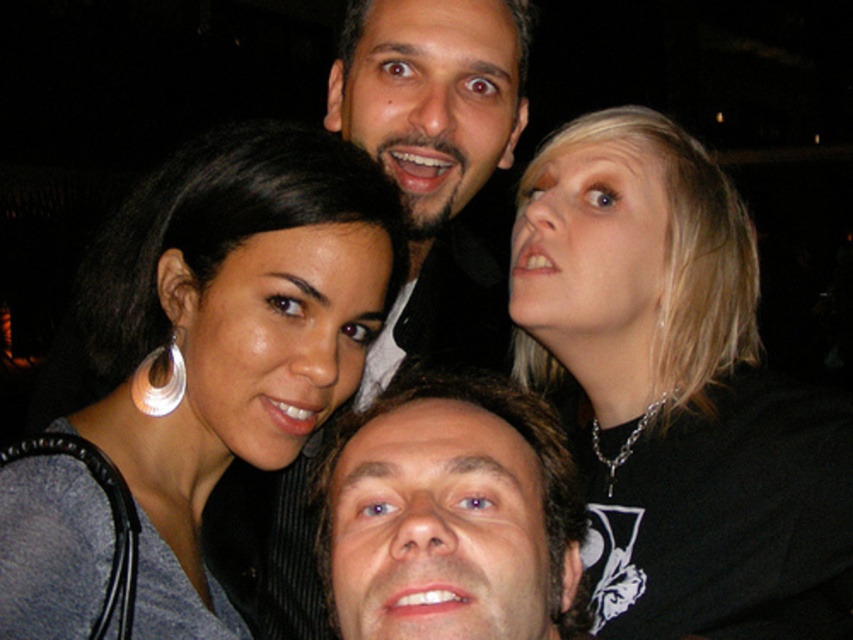
Question: Which is nearer to the bearded man at center?

Choices:
 (A) smooth black shirt at center
 (B) white plastic hoop at upper left
 (C) shiny silver necklace at upper right
 (D) matte black hair at upper left

Answer: (A)

Question: Is matte black hair at upper left positioned before white plastic hoop at upper left?

Choices:
 (A) no
 (B) yes

Answer: (B)

Question: Among these points, which one is nearest to the camera?

Choices:
 (A) (254, 428)
 (B) (387, 86)

Answer: (A)

Question: Does shiny silver necklace at upper right appear over white plastic hoop at upper left?

Choices:
 (A) no
 (B) yes

Answer: (A)

Question: Which object is farther from the camera taking this photo?

Choices:
 (A) bearded man at center
 (B) matte black hair at upper left
 (C) smooth black shirt at center

Answer: (A)

Question: Can you confirm if smooth black shirt at center is positioned to the left of white plastic hoop at upper left?

Choices:
 (A) yes
 (B) no

Answer: (B)